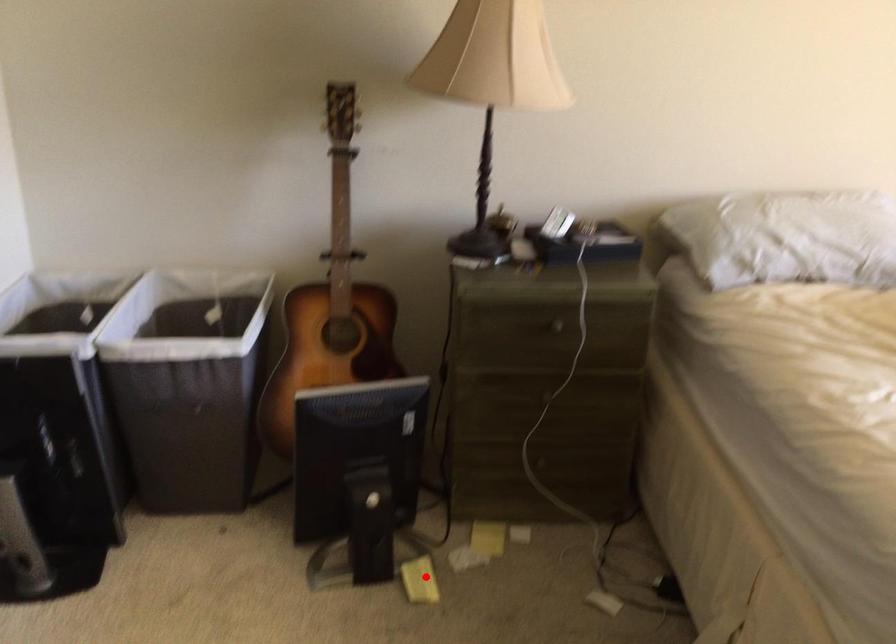
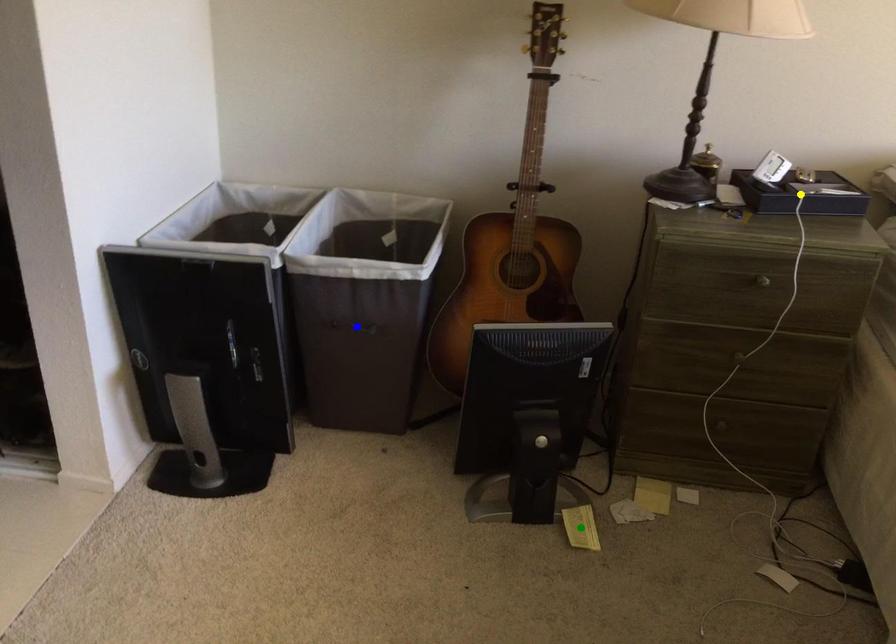
Question: I am providing you with two images of the same scene from different viewpoints. A red point is marked on the first image. You are given multiple points on the second image. In image 2, which mark is for the same physical point as the one in image 1?

Choices:
 (A) blue point
 (B) green point
 (C) yellow point

Answer: (B)